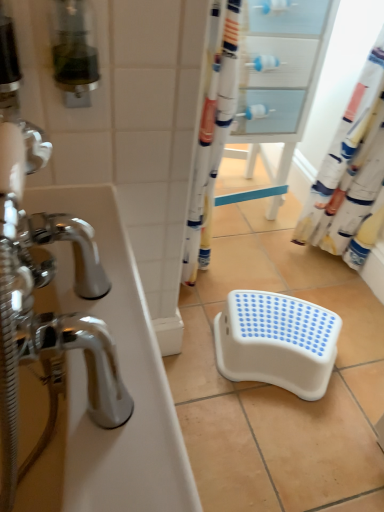
Locate an element on the screen. blank area to the left of white fabric shower curtain at right is located at coordinates (278, 250).